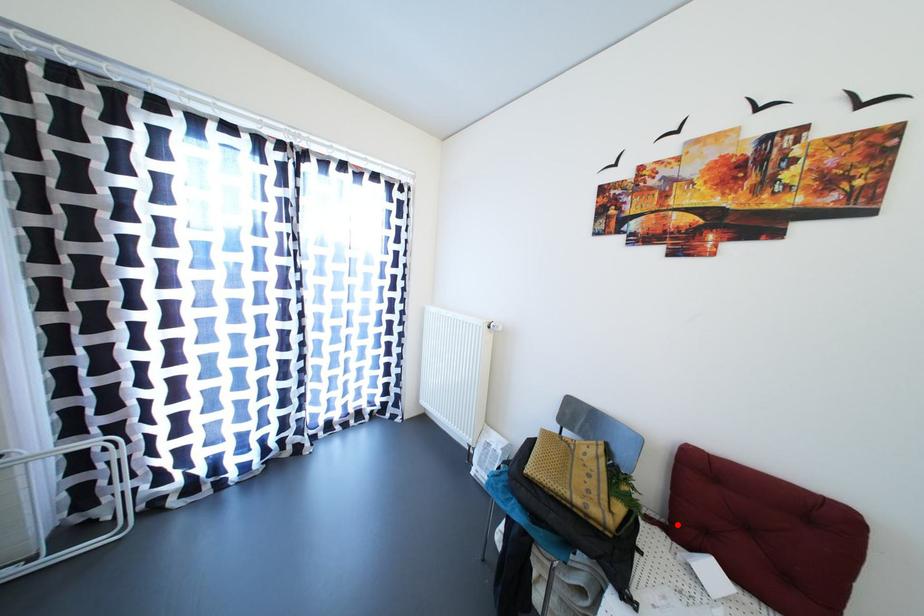
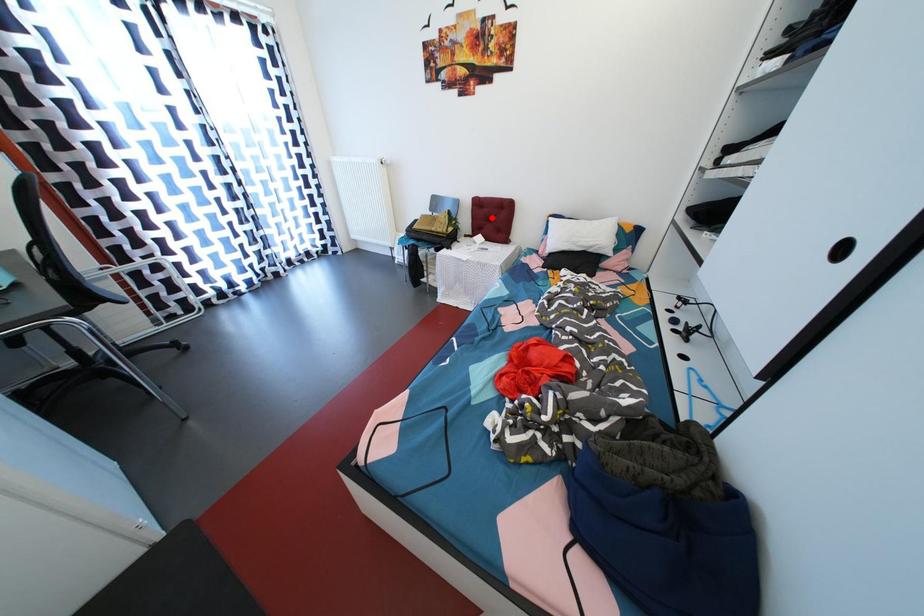
I am providing you with two images of the same scene from different viewpoints. A red point is marked on the first image and another point is marked on the second image. Is the marked point in image1 the same physical position as the marked point in image2?

No